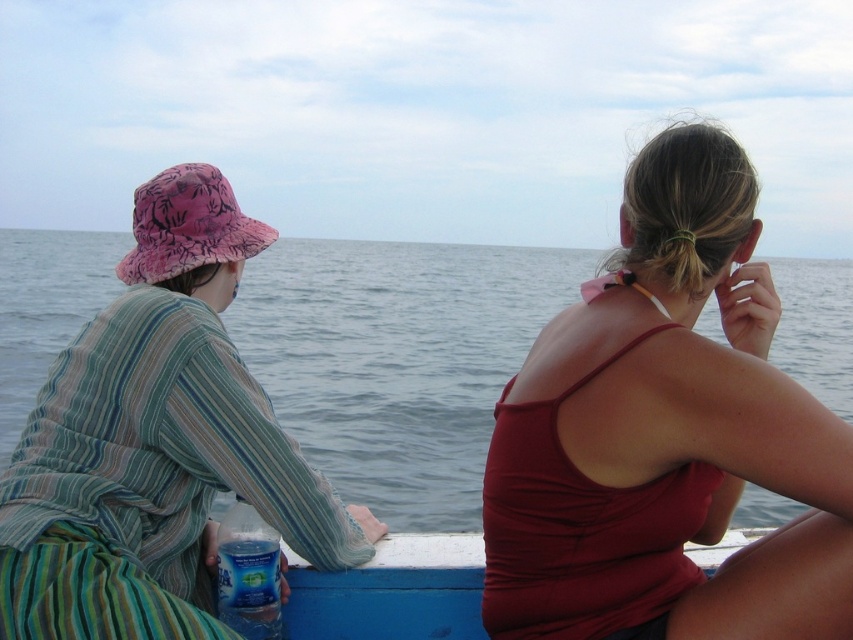
Which is behind, point (799, 369) or point (198, 208)?

Point (799, 369)

Between point (440, 410) and point (212, 204), which one is positioned in front?

Point (212, 204) is in front.

Where is `blue water at center`? The height and width of the screenshot is (640, 853). blue water at center is located at coordinates (397, 358).

Between striped cotton shirt at left and blue painted wood boat at lower center, which one is positioned lower?

blue painted wood boat at lower center is lower down.

At what (x,y) coordinates should I click in order to perform the action: click on striped cotton shirt at left. Please return your answer as a coordinate pair (x, y). This screenshot has height=640, width=853. Looking at the image, I should click on (155, 444).

Can you confirm if striped cotton shirt at left is taller than pink fabric hat at left?

Correct, striped cotton shirt at left is much taller as pink fabric hat at left.

Does point (97, 438) come closer to viewer compared to point (239, 236)?

That is True.

Measure the distance between striped cotton shirt at left and camera.

The distance of striped cotton shirt at left from camera is 1.86 meters.

The height and width of the screenshot is (640, 853). I want to click on striped cotton shirt at left, so click(155, 444).